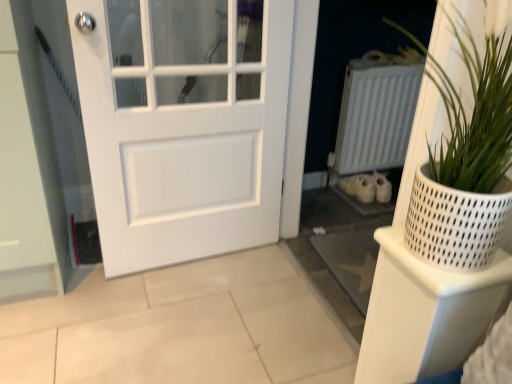
Question: Is white textured pot at right located outside white plastic shelf at right?

Choices:
 (A) no
 (B) yes

Answer: (B)

Question: Is white textured pot at right bigger than white plastic shelf at right?

Choices:
 (A) yes
 (B) no

Answer: (A)

Question: Is white textured pot at right touching white plastic shelf at right?

Choices:
 (A) yes
 (B) no

Answer: (B)

Question: From a real-world perspective, does white textured pot at right stand above white plastic shelf at right?

Choices:
 (A) yes
 (B) no

Answer: (A)

Question: Can you confirm if white textured pot at right is positioned to the right of white plastic shelf at right?

Choices:
 (A) no
 (B) yes

Answer: (B)

Question: Considering the positions of white matte radiator at center right and white plastic shelf at right in the image, is white matte radiator at center right taller or shorter than white plastic shelf at right?

Choices:
 (A) short
 (B) tall

Answer: (B)

Question: From the image's perspective, is white matte radiator at center right above or below white plastic shelf at right?

Choices:
 (A) above
 (B) below

Answer: (A)

Question: Is white matte radiator at center right in front of or behind white plastic shelf at right in the image?

Choices:
 (A) behind
 (B) front

Answer: (A)

Question: Looking at the image, does white matte radiator at center right seem bigger or smaller compared to white plastic shelf at right?

Choices:
 (A) big
 (B) small

Answer: (A)

Question: Is point (390, 240) positioned closer to the camera than point (483, 259)?

Choices:
 (A) closer
 (B) farther

Answer: (B)

Question: Is white plastic shelf at right in front of or behind white textured pot at right in the image?

Choices:
 (A) behind
 (B) front

Answer: (A)

Question: In terms of height, does white plastic shelf at right look taller or shorter compared to white textured pot at right?

Choices:
 (A) tall
 (B) short

Answer: (A)

Question: From the image's perspective, is white plastic shelf at right located above or below white textured pot at right?

Choices:
 (A) below
 (B) above

Answer: (A)

Question: Would you say white plastic shelf at right is inside or outside white matte radiator at center right?

Choices:
 (A) inside
 (B) outside

Answer: (B)

Question: Is white plastic shelf at right wider or thinner than white matte radiator at center right?

Choices:
 (A) thin
 (B) wide

Answer: (B)